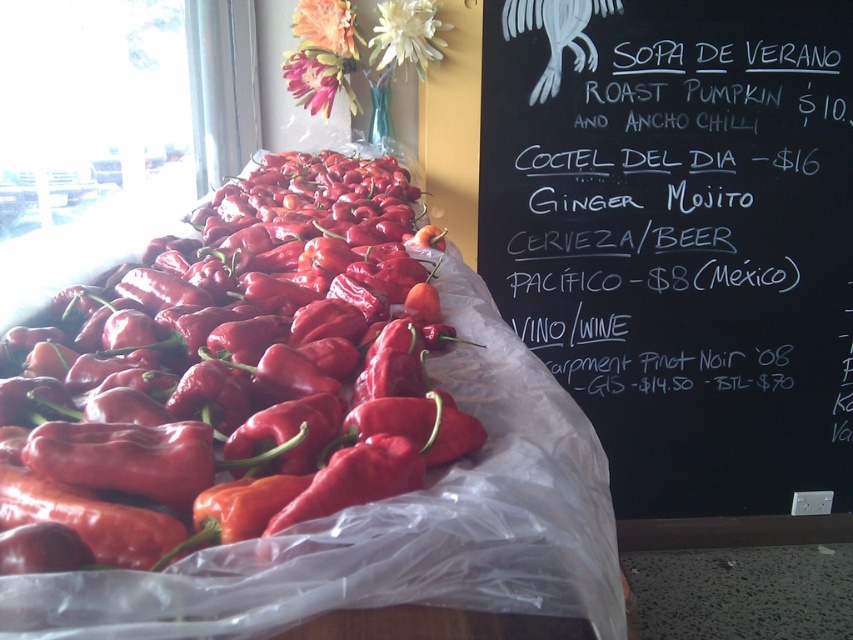
Is black chalkboard at upper right positioned before shiny red pepper at left?

No, it is not.

Identify the location of black chalkboard at upper right. The width and height of the screenshot is (853, 640). (682, 248).

From the picture: Is shiny red pepper at left to the right of white matte flower at upper center from the viewer's perspective?

No, shiny red pepper at left is not to the right of white matte flower at upper center.

Is point (68, 314) more distant than point (416, 35)?

That is False.

Does point (190, 419) come in front of point (419, 44)?

Yes, point (190, 419) is in front of point (419, 44).

This screenshot has height=640, width=853. Identify the location of shiny red pepper at left. (x=231, y=378).

Describe the element at coordinates (231, 378) in the screenshot. I see `shiny red pepper at left` at that location.

Is point (77, 442) closer to camera compared to point (318, 28)?

Yes.

Where is `shiny red pepper at left`? shiny red pepper at left is located at coordinates (231, 378).